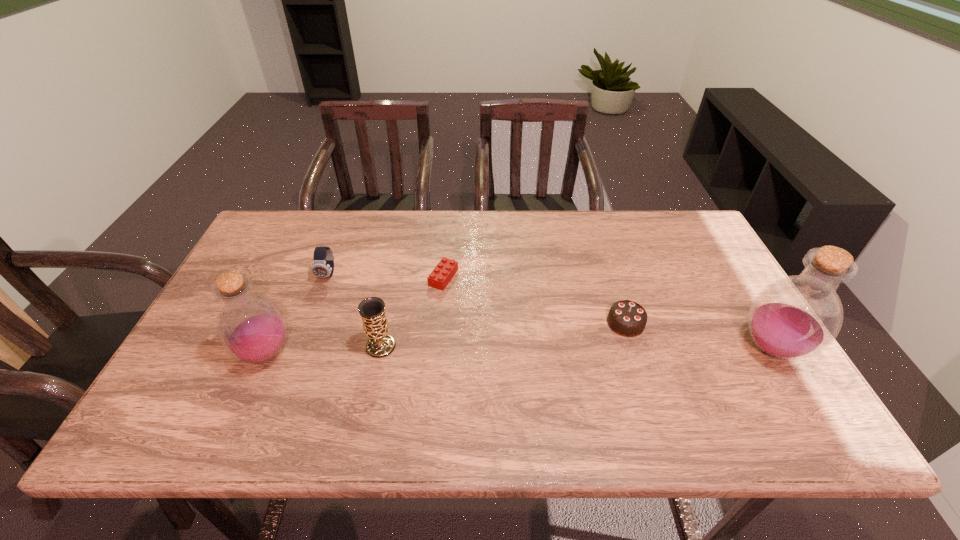
The height and width of the screenshot is (540, 960). What are the coordinates of `free point that satisfies the following two spatial constraints: 1. on the face of the chalice; 2. on the left side of the watch` in the screenshot? It's located at (301, 347).

Find the location of a particular element. This screenshot has width=960, height=540. free location that satisfies the following two spatial constraints: 1. on the face of the fourth tallest object; 2. on the left side of the fourth shortest object is located at coordinates (301, 347).

Identify the location of vacant space that satisfies the following two spatial constraints: 1. on the back side of the left bottle; 2. on the right side of the rightmost object. Image resolution: width=960 pixels, height=540 pixels. (269, 348).